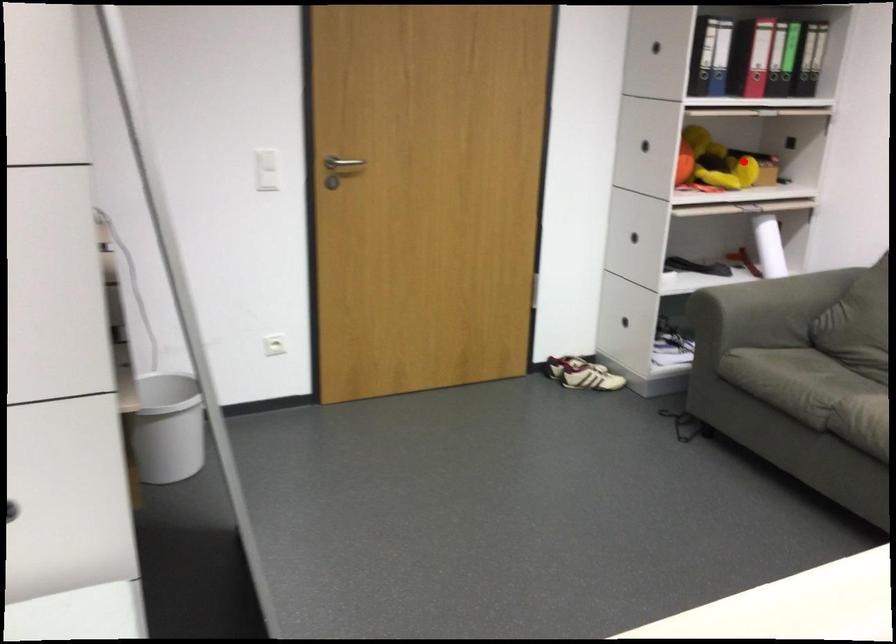
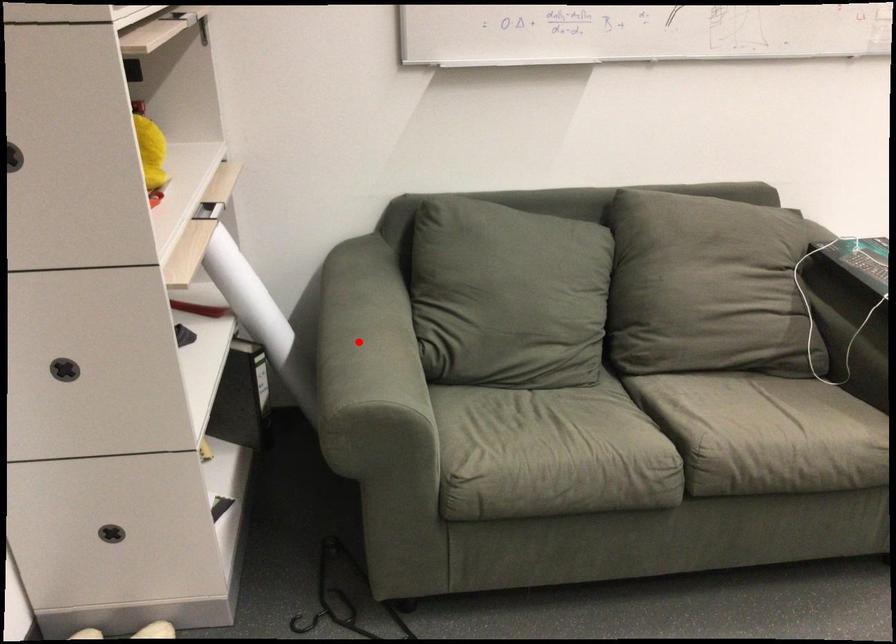
I am providing you with two images of the same scene from different viewpoints. A red point is marked on the first image and another point is marked on the second image. Are the points marked in image1 and image2 representing the same 3D position?

No